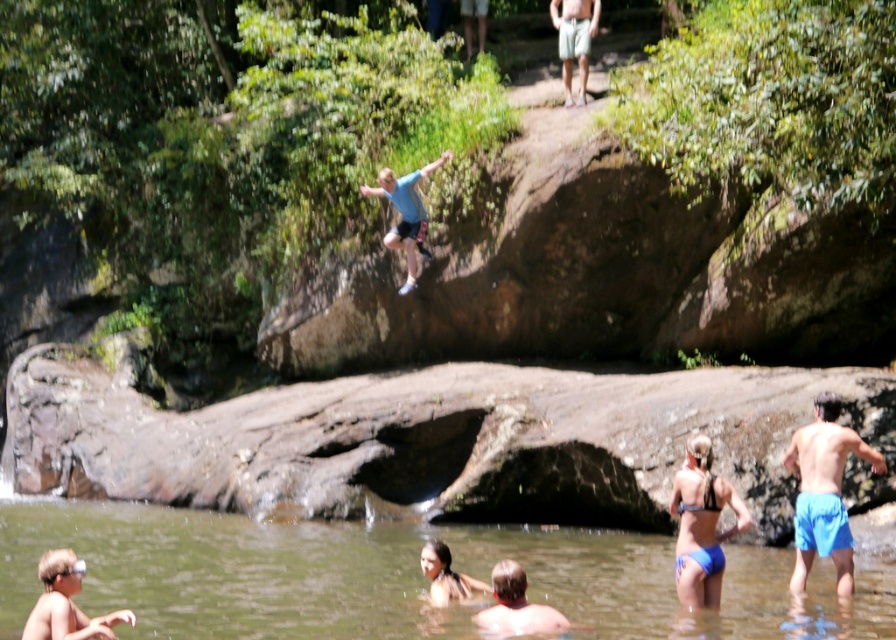
You are a photographer standing at the edge of the water. You want to take a photo that includes both the blue fabric shorts at lower right and the smooth skin boy at lower left. Which object should you position closer to the front of the frame to ensure both are fully visible?

You should position the smooth skin boy at lower left closer to the front of the frame because the blue fabric shorts at lower right is much taller, so placing the shorter smooth skin boy at lower left in front will help both fit within the frame without one blocking the other.